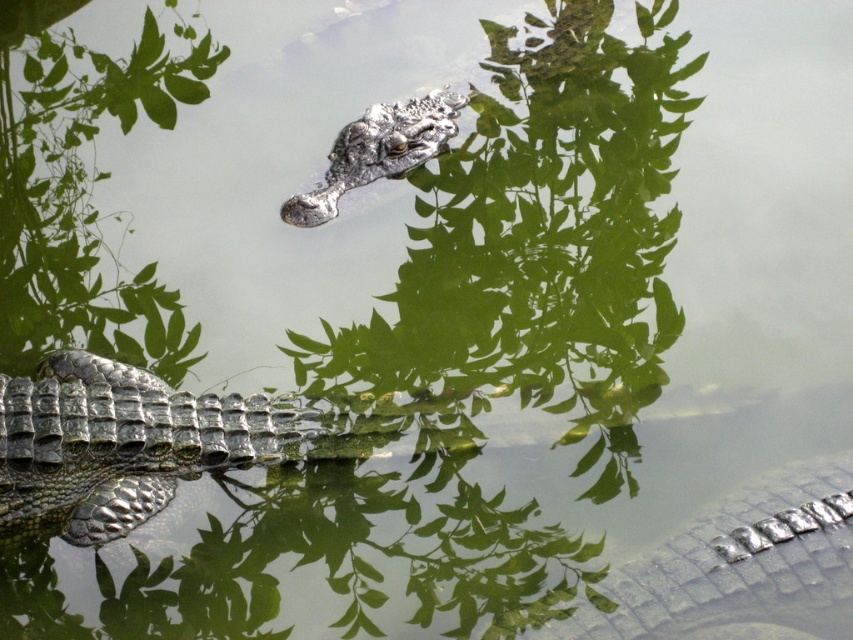
Question: Does green scaly crocodile at lower left appear under shiny green scales at lower right?

Choices:
 (A) yes
 (B) no

Answer: (B)

Question: Observing the image, what is the correct spatial positioning of shiny green scales at lower right in reference to shiny metallic crocodile at center?

Choices:
 (A) above
 (B) below

Answer: (B)

Question: Which object is positioned closest to the shiny metallic crocodile at center?

Choices:
 (A) green scaly crocodile at lower left
 (B) shiny green scales at lower right

Answer: (A)

Question: Can you confirm if green scaly crocodile at lower left is smaller than shiny green scales at lower right?

Choices:
 (A) yes
 (B) no

Answer: (A)

Question: Which of the following is the closest to the observer?

Choices:
 (A) green scaly crocodile at lower left
 (B) shiny metallic crocodile at center
 (C) shiny green scales at lower right

Answer: (A)

Question: Which point appears closest to the camera in this image?

Choices:
 (A) (440, 92)
 (B) (755, 593)

Answer: (B)